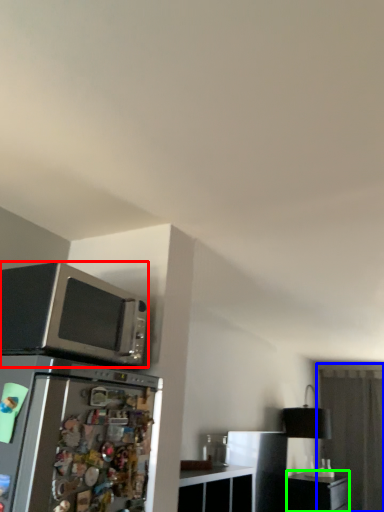
Question: Based on their relative distances, which object is nearer to microwave oven (highlighted by a red box)? Choose from glass door (highlighted by a blue box) and file cabinet (highlighted by a green box).

Choices:
 (A) glass door
 (B) file cabinet

Answer: (B)